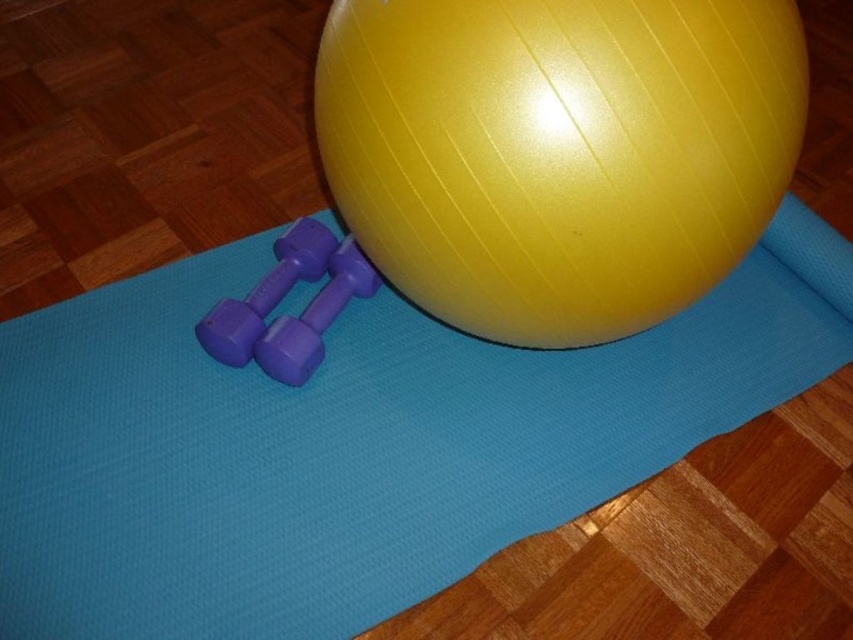
Question: Which is farther from the purple rubber dumbbell at left?

Choices:
 (A) purple rubber dumbbells at center
 (B) glossy yellow ball at center

Answer: (B)

Question: Is blue rubber yoga mat at center further to the viewer compared to purple rubber dumbbell at left?

Choices:
 (A) no
 (B) yes

Answer: (A)

Question: Which point is farther to the camera?

Choices:
 (A) blue rubber yoga mat at center
 (B) purple rubber dumbbell at left

Answer: (B)

Question: Estimate the real-world distances between objects in this image. Which object is closer to the purple rubber dumbbell at left?

Choices:
 (A) blue rubber yoga mat at center
 (B) glossy yellow ball at center

Answer: (A)

Question: Where is purple rubber dumbbell at left located in relation to purple rubber dumbbells at center in the image?

Choices:
 (A) right
 (B) left

Answer: (B)

Question: Does blue rubber yoga mat at center appear under glossy yellow ball at center?

Choices:
 (A) yes
 (B) no

Answer: (A)